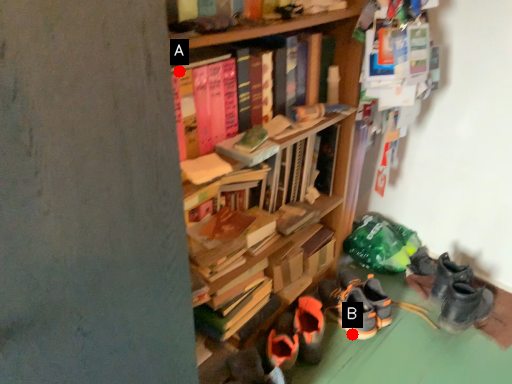
Question: Two points are circled on the image, labeled by A and B beside each circle. Which point appears farthest from the camera in this image?

Choices:
 (A) A is further
 (B) B is further

Answer: (B)